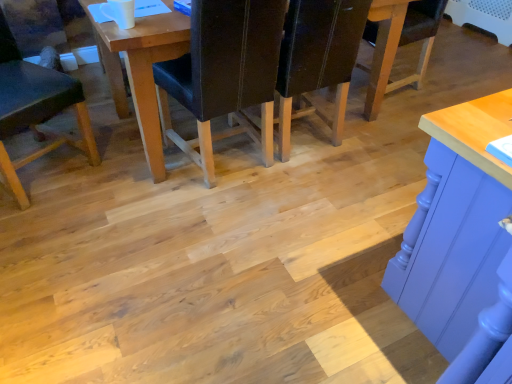
Where is `spots to the right of matte black chair at lower left, the first chair viewed from the left`? This screenshot has width=512, height=384. spots to the right of matte black chair at lower left, the first chair viewed from the left is located at coordinates (118, 179).